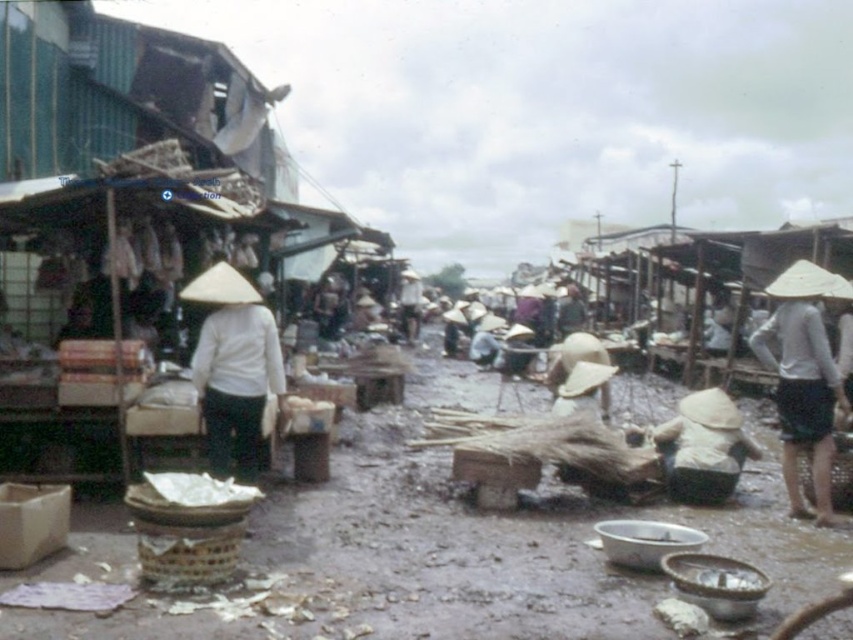
You are standing at the point with coordinates (804, 378) in the market scene. What object is located exactly at your current position?

At point (804, 378) lies a white woven hat at right.

Based on the scene description, where is the white matte conical hat at center located in terms of coordinates?

The white matte conical hat at center is located at coordinates point (233, 369).

You are a customer at the market and want to know which hat is higher between the white matte conical hat at center and the white woven hat at right. Based on the scene, can you determine this?

The white matte conical hat at center is above the white woven hat at right, so it is higher.